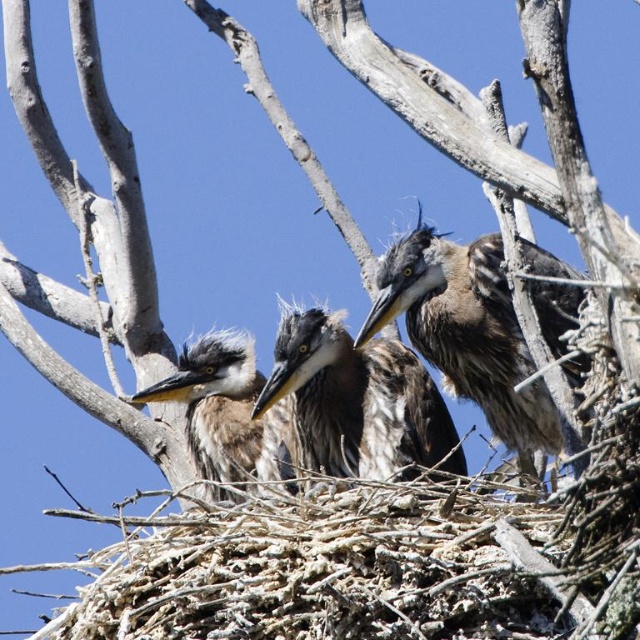
Looking at this image, can you confirm if gray fluffy heron at center is positioned above gray downy feathers at center?

Yes, gray fluffy heron at center is above gray downy feathers at center.

How distant is gray fluffy heron at center from gray downy feathers at center?

gray fluffy heron at center and gray downy feathers at center are 1.48 meters apart.

What do you see at coordinates (467, 332) in the screenshot?
I see `gray fluffy heron at center` at bounding box center [467, 332].

Locate an element on the screen. The width and height of the screenshot is (640, 640). gray fluffy heron at center is located at coordinates (467, 332).

Is gray fluffy heron at center closer to camera compared to grayish-brown feathers at center?

Yes, gray fluffy heron at center is closer to the viewer.

Between point (440, 365) and point (355, 433), which one is positioned in front?

Positioned in front is point (355, 433).

Identify the location of gray fluffy heron at center. The height and width of the screenshot is (640, 640). (467, 332).

Image resolution: width=640 pixels, height=640 pixels. Find the location of `grayish-brown feathers at center`. grayish-brown feathers at center is located at coordinates (356, 401).

Who is more forward, (372, 355) or (259, 428)?

Point (372, 355) is more forward.

At what (x,y) coordinates should I click in order to perform the action: click on grayish-brown feathers at center. Please return your answer as a coordinate pair (x, y). Image resolution: width=640 pixels, height=640 pixels. Looking at the image, I should click on (356, 401).